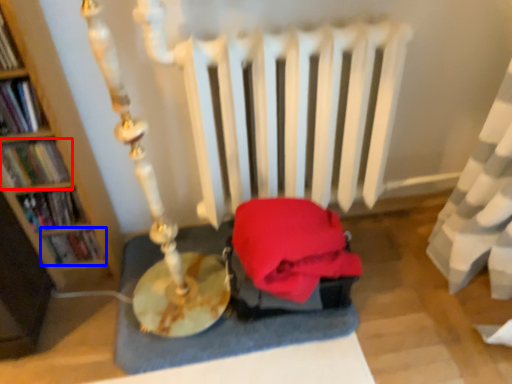
Question: Which point is further to the camera, book (highlighted by a red box) or book (highlighted by a blue box)?

Choices:
 (A) book
 (B) book

Answer: (B)